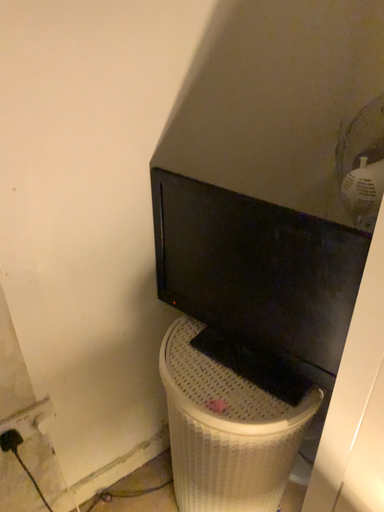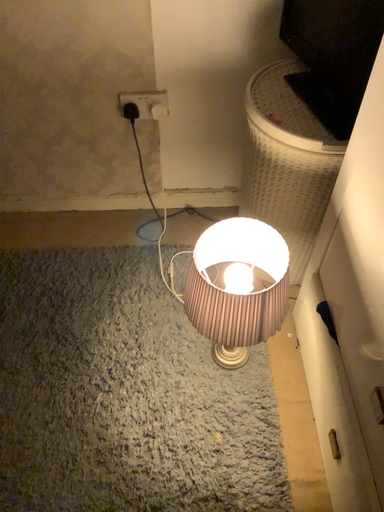
Question: How did the camera likely rotate when shooting the video?

Choices:
 (A) rotated left
 (B) rotated right

Answer: (A)